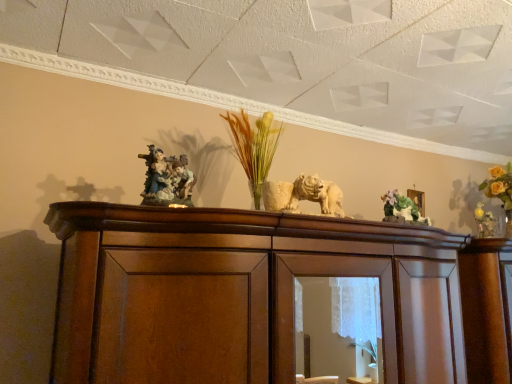
Question: Do you think matte porcelain figurine at center is within green matte floral arrangement at upper right, or outside of it?

Choices:
 (A) outside
 (B) inside

Answer: (A)

Question: Considering the positions of point (154, 160) and point (417, 216), is point (154, 160) closer or farther from the camera than point (417, 216)?

Choices:
 (A) farther
 (B) closer

Answer: (B)

Question: Looking at their shapes, would you say matte porcelain figurine at center is wider or thinner than green matte floral arrangement at upper right?

Choices:
 (A) thin
 (B) wide

Answer: (B)

Question: From the image's perspective, relative to matte porcelain figurine at center, is green matte floral arrangement at upper right above or below?

Choices:
 (A) below
 (B) above

Answer: (A)

Question: From a real-world perspective, is green matte floral arrangement at upper right above or below matte porcelain figurine at center?

Choices:
 (A) above
 (B) below

Answer: (B)

Question: Is green matte floral arrangement at upper right wider or thinner than matte porcelain figurine at center?

Choices:
 (A) thin
 (B) wide

Answer: (A)

Question: In the image, is green matte floral arrangement at upper right on the left side or the right side of matte porcelain figurine at center?

Choices:
 (A) left
 (B) right

Answer: (B)